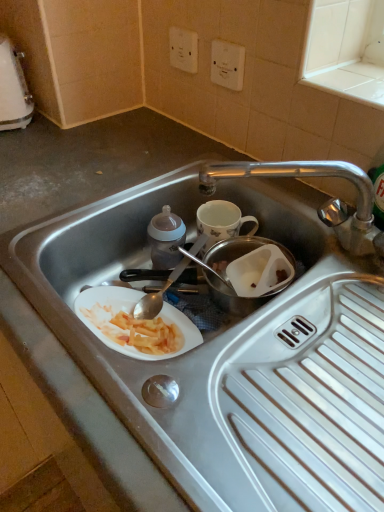
Find the location of a particular element. The width and height of the screenshot is (384, 512). white plastic electric outlet at upper center, arranged as the second electric outlet when viewed from the right is located at coordinates (183, 49).

Find the location of a particular element. This screenshot has height=512, width=384. white plastic electric outlet at upper center, the 2th electric outlet in the left-to-right sequence is located at coordinates (227, 65).

At what (x,y) coordinates should I click in order to perform the action: click on white plastic electric outlet at upper center, which is the 1th electric outlet from left to right. Please return your answer as a coordinate pair (x, y). The height and width of the screenshot is (512, 384). Looking at the image, I should click on (183, 49).

Between white plastic kettle at upper left and white plastic electric outlet at upper center, which is the 1th electric outlet from left to right, which one has larger width?

white plastic kettle at upper left is wider.

From the picture: Does white plastic kettle at upper left come behind white plastic electric outlet at upper center, which is the 1th electric outlet from left to right?

That is False.

Is white plastic kettle at upper left at the right side of white plastic electric outlet at upper center, arranged as the second electric outlet when viewed from the right?

No, white plastic kettle at upper left is not to the right of white plastic electric outlet at upper center, arranged as the second electric outlet when viewed from the right.

How many degrees apart are the facing directions of white plastic kettle at upper left and white plastic electric outlet at upper center, which is the 1th electric outlet from left to right?

The facing directions of white plastic kettle at upper left and white plastic electric outlet at upper center, which is the 1th electric outlet from left to right, are 60.6 degrees apart.

From a real-world perspective, which is physically above, stainless steel sink at center or transparent plastic container at center?

stainless steel sink at center, from a real-world perspective.

Which point is more distant from viewer, (319, 409) or (228, 255)?

Positioned behind is point (228, 255).

Based on the photo, who is bigger, stainless steel sink at center or transparent plastic container at center?

stainless steel sink at center is bigger.

Looking at this image, is stainless steel sink at center not inside transparent plastic container at center?

Yes.

Which object is thinner, white plastic kettle at upper left or stainless steel sink at center?

white plastic kettle at upper left is thinner.

This screenshot has width=384, height=512. Identify the location of appliance above the stainless steel sink at center (from the image's perspective). (13, 89).

Which point is more forward, (0, 121) or (190, 413)?

Point (190, 413)

Does white plastic kettle at upper left contain stainless steel sink at center?

No.

Looking at this image, considering the relative positions of white plastic electric outlet at upper center, which is the 1th electric outlet from left to right, and stainless steel sink at center in the image provided, is white plastic electric outlet at upper center, which is the 1th electric outlet from left to right, to the right of stainless steel sink at center from the viewer's perspective?

Indeed, white plastic electric outlet at upper center, which is the 1th electric outlet from left to right, is positioned on the right side of stainless steel sink at center.

Between point (183, 52) and point (224, 442), which one is positioned in front?

Point (224, 442)

In terms of width, does white plastic electric outlet at upper center, which is the 1th electric outlet from left to right, look wider or thinner when compared to stainless steel sink at center?

Considering their sizes, white plastic electric outlet at upper center, which is the 1th electric outlet from left to right, looks slimmer than stainless steel sink at center.

Is white plastic electric outlet at upper center, positioned as the first electric outlet in right-to-left order, outside of white plastic electric outlet at upper center, arranged as the second electric outlet when viewed from the right?

That's correct, white plastic electric outlet at upper center, positioned as the first electric outlet in right-to-left order, is outside of white plastic electric outlet at upper center, arranged as the second electric outlet when viewed from the right.

From the image's perspective, is white plastic electric outlet at upper center, the 2th electric outlet in the left-to-right sequence, located above or below white plastic electric outlet at upper center, which is the 1th electric outlet from left to right?

Based on their image positions, white plastic electric outlet at upper center, the 2th electric outlet in the left-to-right sequence, is located beneath white plastic electric outlet at upper center, which is the 1th electric outlet from left to right.

Is there a large distance between white plastic electric outlet at upper center, the 2th electric outlet in the left-to-right sequence, and white plastic electric outlet at upper center, arranged as the second electric outlet when viewed from the right?

They are positioned close to each other.

How distant is transparent plastic container at center from stainless steel sink at center?

A distance of 7.49 inches exists between transparent plastic container at center and stainless steel sink at center.

Is transparent plastic container at center oriented away from stainless steel sink at center?

Correct, transparent plastic container at center is looking away from stainless steel sink at center.

From a real-world perspective, is transparent plastic container at center physically located above or below stainless steel sink at center?

In terms of real-world spatial position, transparent plastic container at center is below stainless steel sink at center.

Between stainless steel sink at center and white plastic kettle at upper left, which one is positioned behind?

white plastic kettle at upper left.

Is stainless steel sink at center oriented away from white plastic kettle at upper left?

No, stainless steel sink at center is not facing away from white plastic kettle at upper left.

Looking at the image, does stainless steel sink at center seem bigger or smaller compared to white plastic kettle at upper left?

Considering their sizes, stainless steel sink at center takes up more space than white plastic kettle at upper left.

Find the location of a particular element. The width and height of the screenshot is (384, 512). the 1st electric outlet counting from the right of the white plastic kettle at upper left is located at coordinates (183, 49).

You are a GUI agent. You are given a task and a screenshot of the screen. Output one action in this format:
    pyautogui.click(x=<x>, y=<y>)
    Task: Click on the sink above the transparent plastic container at center (from a real-world perspective)
    
    Given the screenshot: What is the action you would take?
    pyautogui.click(x=221, y=348)

When comparing their distances from white plastic electric outlet at upper center, which is the 1th electric outlet from left to right, does stainless steel sink at center or white plastic kettle at upper left seem closer?

The object closer to white plastic electric outlet at upper center, which is the 1th electric outlet from left to right, is white plastic kettle at upper left.

From the image, which object appears to be farther from white plastic kettle at upper left, stainless steel sink at center or transparent plastic container at center?

stainless steel sink at center is positioned further to the anchor white plastic kettle at upper left.

From the image, which object appears to be nearer to white plastic kettle at upper left, white plastic electric outlet at upper center, positioned as the first electric outlet in right-to-left order, or white plastic electric outlet at upper center, arranged as the second electric outlet when viewed from the right?

Based on the image, white plastic electric outlet at upper center, arranged as the second electric outlet when viewed from the right, appears to be nearer to white plastic kettle at upper left.

Looking at the image, which one is located closer to white plastic kettle at upper left, transparent plastic container at center or white plastic electric outlet at upper center, which is the 1th electric outlet from left to right?

The object closer to white plastic kettle at upper left is white plastic electric outlet at upper center, which is the 1th electric outlet from left to right.

From the image, which object appears to be nearer to white plastic electric outlet at upper center, positioned as the first electric outlet in right-to-left order, transparent plastic container at center or white plastic kettle at upper left?

Among the two, transparent plastic container at center is located nearer to white plastic electric outlet at upper center, positioned as the first electric outlet in right-to-left order.

Which object lies further to the anchor point white plastic electric outlet at upper center, positioned as the first electric outlet in right-to-left order, white plastic electric outlet at upper center, which is the 1th electric outlet from left to right, or stainless steel sink at center?

stainless steel sink at center lies further to white plastic electric outlet at upper center, positioned as the first electric outlet in right-to-left order, than the other object.

Which object lies nearer to the anchor point transparent plastic container at center, white plastic kettle at upper left or stainless steel sink at center?

Based on the image, stainless steel sink at center appears to be nearer to transparent plastic container at center.

From the image, which object appears to be nearer to stainless steel sink at center, white plastic electric outlet at upper center, positioned as the first electric outlet in right-to-left order, or transparent plastic container at center?

transparent plastic container at center is positioned closer to the anchor stainless steel sink at center.

This screenshot has height=512, width=384. Identify the location of electric outlet between white plastic electric outlet at upper center, arranged as the second electric outlet when viewed from the right, and transparent plastic container at center, in the vertical direction. (227, 65).

Where is `side dish between white plastic electric outlet at upper center, which is the 1th electric outlet from left to right, and stainless steel sink at center in the up-down direction`? The height and width of the screenshot is (512, 384). side dish between white plastic electric outlet at upper center, which is the 1th electric outlet from left to right, and stainless steel sink at center in the up-down direction is located at coordinates (239, 251).

Identify the location of electric outlet between white plastic electric outlet at upper center, which is the 1th electric outlet from left to right, and stainless steel sink at center vertically. The image size is (384, 512). (227, 65).

At what (x,y) coordinates should I click in order to perform the action: click on sink located between white plastic kettle at upper left and white plastic electric outlet at upper center, the 2th electric outlet in the left-to-right sequence, in the left-right direction. Please return your answer as a coordinate pair (x, y). This screenshot has height=512, width=384. Looking at the image, I should click on (221, 348).